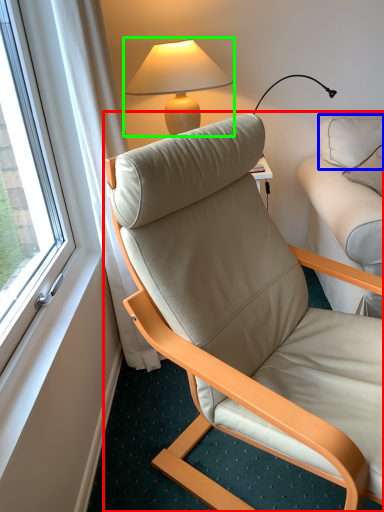
Question: Estimate the real-world distances between objects in this image. Which object is closer to chair (highlighted by a red box), pillow (highlighted by a blue box) or lamp (highlighted by a green box)?

Choices:
 (A) pillow
 (B) lamp

Answer: (B)